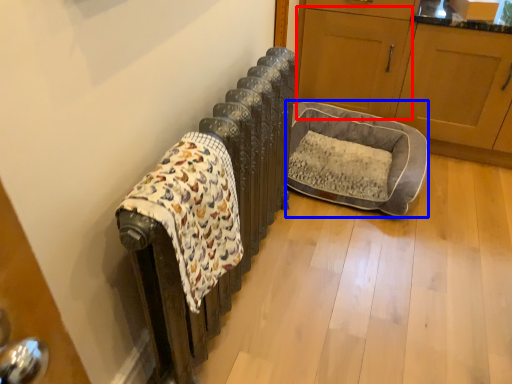
Question: Which object appears farthest to the camera in this image, screen door (highlighted by a red box) or dog bed (highlighted by a blue box)?

Choices:
 (A) screen door
 (B) dog bed

Answer: (A)